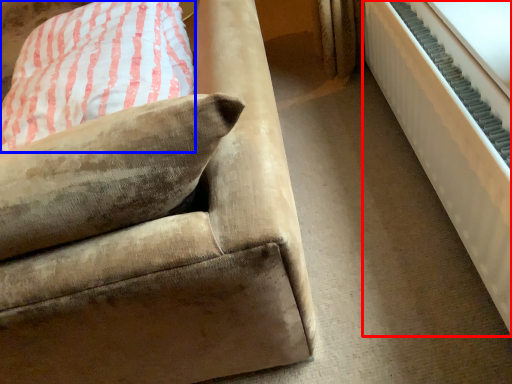
Question: Which point is closer to the camera, radiator (highlighted by a red box) or pillow (highlighted by a blue box)?

Choices:
 (A) radiator
 (B) pillow

Answer: (A)